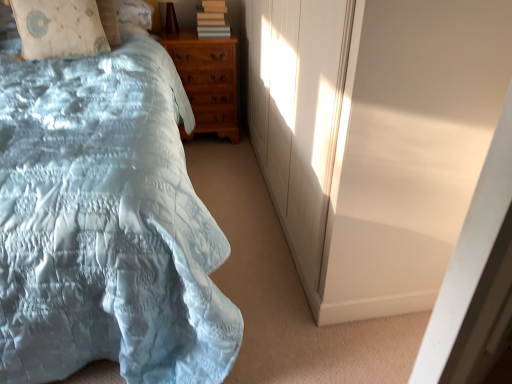
At what (x,y) coordinates should I click in order to perform the action: click on matte brown table lamp at upper center. Please return your answer as a coordinate pair (x, y). This screenshot has width=512, height=384. Looking at the image, I should click on [x=170, y=17].

The image size is (512, 384). Identify the location of light blue satin bed at left. (106, 225).

At what (x,y) coordinates should I click in order to perform the action: click on beige fabric pillow at upper left. Please return your answer as a coordinate pair (x, y). Image resolution: width=512 pixels, height=384 pixels. Looking at the image, I should click on (59, 28).

Describe the element at coordinates (212, 20) in the screenshot. I see `matte gray book at upper center` at that location.

The height and width of the screenshot is (384, 512). In order to click on matte brown table lamp at upper center in this screenshot , I will do `click(170, 17)`.

Is light blue satin bed at left not inside matte gray book at upper center?

Indeed, light blue satin bed at left is completely outside matte gray book at upper center.

Considering the relative positions of light blue satin bed at left and matte gray book at upper center in the image provided, is light blue satin bed at left in front of matte gray book at upper center?

Yes, it is in front of matte gray book at upper center.

From the image's perspective, between light blue satin bed at left and matte gray book at upper center, which one is located above?

matte gray book at upper center appears higher in the image.

Can you confirm if light blue satin bed at left is bigger than matte gray book at upper center?

Yes.

Would you say white matte screen door at upper right is to the left or to the right of light blue satin bed at left in the picture?

From the image, it's evident that white matte screen door at upper right is to the right of light blue satin bed at left.

How many degrees apart are the facing directions of white matte screen door at upper right and light blue satin bed at left?

29.2 degrees separate the facing orientations of white matte screen door at upper right and light blue satin bed at left.

Can you confirm if white matte screen door at upper right is bigger than light blue satin bed at left?

No.

Which is closer, (346, 267) or (197, 224)?

Point (346, 267).

From the image's perspective, is matte gray book at upper center beneath light blue satin bed at left?

No, from the image's perspective, matte gray book at upper center is not beneath light blue satin bed at left.

Would you say matte gray book at upper center is outside light blue satin bed at left?

That's correct, matte gray book at upper center is outside of light blue satin bed at left.

Find the location of a particular element. bed in front of the matte gray book at upper center is located at coordinates (106, 225).

Which of these two, matte gray book at upper center or light blue satin bed at left, is bigger?

With larger size is light blue satin bed at left.

Who is smaller, beige fabric pillow at upper left or white matte screen door at upper right?

beige fabric pillow at upper left is smaller.

Considering the points (83, 46) and (392, 81), which point is behind, point (83, 46) or point (392, 81)?

The point (83, 46) is farther from the camera.

From the image's perspective, does beige fabric pillow at upper left appear lower than white matte screen door at upper right?

No.

Is beige fabric pillow at upper left in contact with white matte screen door at upper right?

beige fabric pillow at upper left is not next to white matte screen door at upper right, and they're not touching.

Consider the image. Is matte brown table lamp at upper center closer to camera compared to matte gray book at upper center?

Yes, the depth of matte brown table lamp at upper center is less than that of matte gray book at upper center.

From the picture: Is matte brown table lamp at upper center to the left of matte gray book at upper center from the viewer's perspective?

Correct, you'll find matte brown table lamp at upper center to the left of matte gray book at upper center.

Find the location of a particular element. The image size is (512, 384). book on the right of the matte brown table lamp at upper center is located at coordinates (212, 20).

Is matte brown table lamp at upper center next to matte gray book at upper center and touching it?

matte brown table lamp at upper center and matte gray book at upper center are not in contact.

Which of these two, matte gray book at upper center or white matte screen door at upper right, is wider?

matte gray book at upper center.

From the image's perspective, is matte gray book at upper center located beneath white matte screen door at upper right?

No, from the image's perspective, matte gray book at upper center is not beneath white matte screen door at upper right.

The width and height of the screenshot is (512, 384). In order to click on bed on the left side of light brown wooden chest of drawers at center in this screenshot , I will do `click(106, 225)`.

Is light brown wooden chest of drawers at center wider or thinner than light blue satin bed at left?

Clearly, light brown wooden chest of drawers at center has less width compared to light blue satin bed at left.

From a real-world perspective, is light brown wooden chest of drawers at center on light blue satin bed at left?

No, from a real-world perspective, light brown wooden chest of drawers at center is not over light blue satin bed at left

In order to click on book behind the light blue satin bed at left in this screenshot , I will do `click(212, 20)`.

Identify the location of bed in front of the white matte screen door at upper right. (106, 225).

In the scene shown: From the image, which object appears to be nearer to light brown wooden chest of drawers at center, beige fabric pillow at upper left or matte gray book at upper center?

matte gray book at upper center lies closer to light brown wooden chest of drawers at center than the other object.

Looking at this image, which object lies further to the anchor point light brown wooden chest of drawers at center, matte brown table lamp at upper center or matte gray book at upper center?

matte brown table lamp at upper center is further to light brown wooden chest of drawers at center.

From the image, which object appears to be nearer to white matte screen door at upper right, light brown wooden chest of drawers at center or matte gray book at upper center?

Based on the image, light brown wooden chest of drawers at center appears to be nearer to white matte screen door at upper right.

In the scene shown: Looking at the image, which one is located further to white matte screen door at upper right, beige fabric pillow at upper left or light brown wooden chest of drawers at center?

beige fabric pillow at upper left is positioned further to the anchor white matte screen door at upper right.

Estimate the real-world distances between objects in this image. Which object is further from matte brown table lamp at upper center, white matte screen door at upper right or matte gray book at upper center?

The object further to matte brown table lamp at upper center is white matte screen door at upper right.

Looking at the image, which one is located further to white matte screen door at upper right, matte gray book at upper center or beige fabric pillow at upper left?

matte gray book at upper center is positioned further to the anchor white matte screen door at upper right.

In the scene shown: When comparing their distances from light brown wooden chest of drawers at center, does matte gray book at upper center or beige fabric pillow at upper left seem further?

beige fabric pillow at upper left.

From the image, which object appears to be farther from white matte screen door at upper right, beige fabric pillow at upper left or matte gray book at upper center?

matte gray book at upper center.

What are the coordinates of `table lamp positioned between white matte screen door at upper right and matte gray book at upper center from near to far` in the screenshot? It's located at (170, 17).

Find the location of a particular element. The width and height of the screenshot is (512, 384). book between matte brown table lamp at upper center and light brown wooden chest of drawers at center vertically is located at coordinates (212, 20).

Locate an element on the screen. This screenshot has width=512, height=384. table lamp located between light blue satin bed at left and matte gray book at upper center in the depth direction is located at coordinates [170, 17].

Identify the location of book between white matte screen door at upper right and light brown wooden chest of drawers at center in the front-back direction. (212, 20).